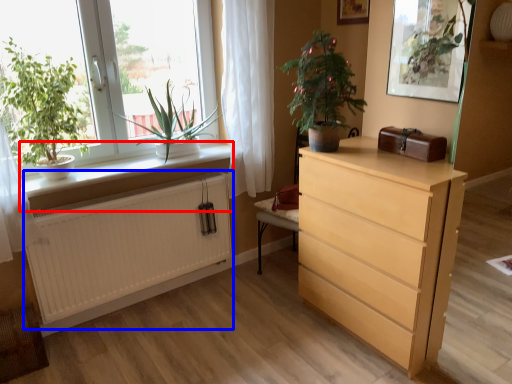
Question: Which object is closer to the camera taking this photo, window sill (highlighted by a red box) or radiator (highlighted by a blue box)?

Choices:
 (A) window sill
 (B) radiator

Answer: (A)